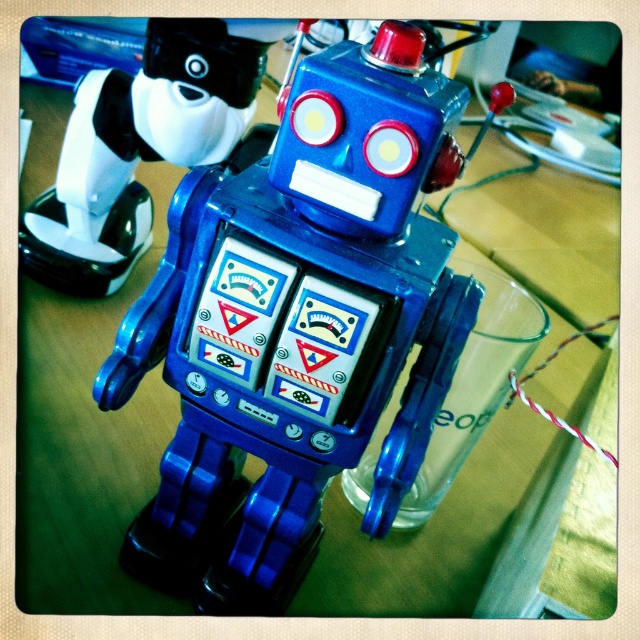
You are a child who wants to place both the metallic blue robot at center and the blue plastic robot at center on your desk. However, your desk has limited space. Based on the image, which robot requires more horizontal space to fit on the desk?

The metallic blue robot at center requires more horizontal space because its width surpasses that of the blue plastic robot at center.

You are a toy collector who wants to place a new 5 inch tall robot on the table where the metallic blue robot at center and the blue plastic robot at center are already present. Can you fit the new robot between them without moving the existing ones?

The distance between the metallic blue robot at center and the blue plastic robot at center is 4.93 inches. Since the new robot is 5 inches tall, it might not fit between them as the space is slightly smaller than the robot height.

You are a collector of vintage robots and you see both the metallic blue robot at center and the blue plastic robot at center in the image. Which one is positioned lower in the scene?

The metallic blue robot at center is positioned lower than the blue plastic robot at center.